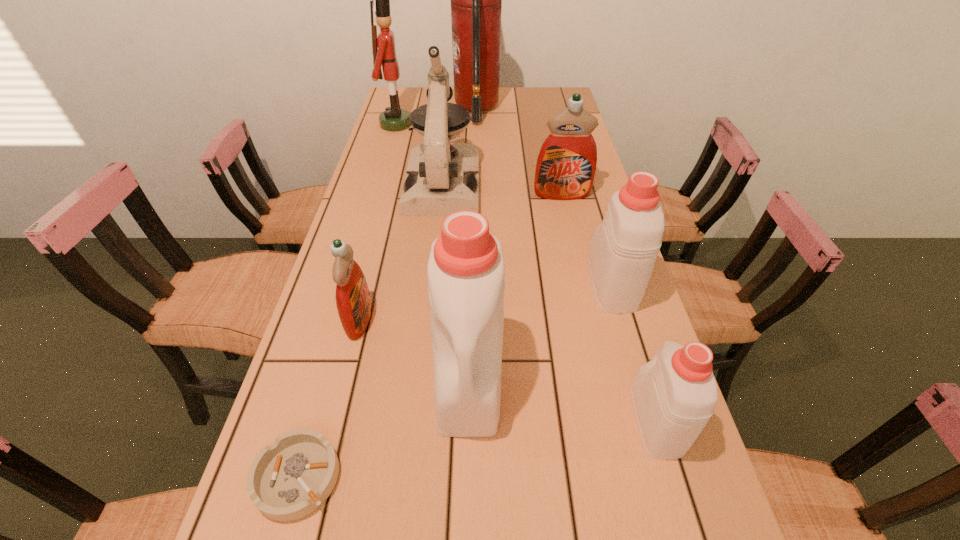
I want to click on vacant space at the left edge of the desktop, so click(367, 204).

What are the coordinates of `free space at the far right corner` in the screenshot? It's located at (533, 100).

Where is `vacant space that is in between the farther red detergent and the second smallest white detergent`? The height and width of the screenshot is (540, 960). vacant space that is in between the farther red detergent and the second smallest white detergent is located at coordinates (587, 239).

Image resolution: width=960 pixels, height=540 pixels. I want to click on vacant area between the ashtray and the smaller red detergent, so click(x=328, y=398).

The width and height of the screenshot is (960, 540). Find the location of `empty location between the smallest white detergent and the red fire extinguisher`. empty location between the smallest white detergent and the red fire extinguisher is located at coordinates pos(565,265).

Locate an element on the screen. Image resolution: width=960 pixels, height=540 pixels. free space between the microscope and the farthest white detergent is located at coordinates (527, 234).

Find the location of a particular element. The image size is (960, 540). vacant area between the smallest white detergent and the red fire extinguisher is located at coordinates (565, 265).

In order to click on the fourth closest object to the fire extinguisher in this screenshot , I will do `click(622, 254)`.

Locate an element on the screen. The width and height of the screenshot is (960, 540). the seventh closest object relative to the microscope is located at coordinates (674, 395).

This screenshot has height=540, width=960. Find the location of `detergent that stands as the closest to the shortest object`. detergent that stands as the closest to the shortest object is located at coordinates (465, 271).